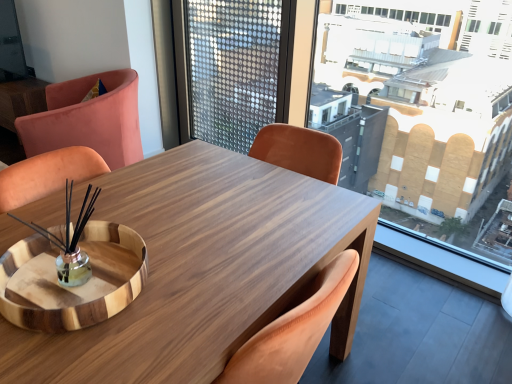
Question: Should I look upward or downward to see wooden tray at center?

Choices:
 (A) up
 (B) down

Answer: (B)